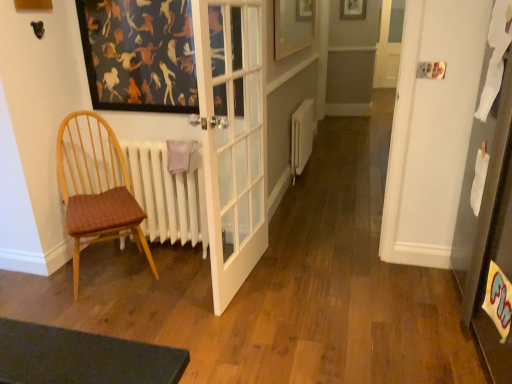
You are a GUI agent. You are given a task and a screenshot of the screen. Output one action in this format:
    pyautogui.click(x=<x>, y=<y>)
    Task: Click on the vacant space in woven fabric chair at left (from a real-world perspective)
    The width and height of the screenshot is (512, 384).
    Given the screenshot: What is the action you would take?
    pyautogui.click(x=110, y=273)